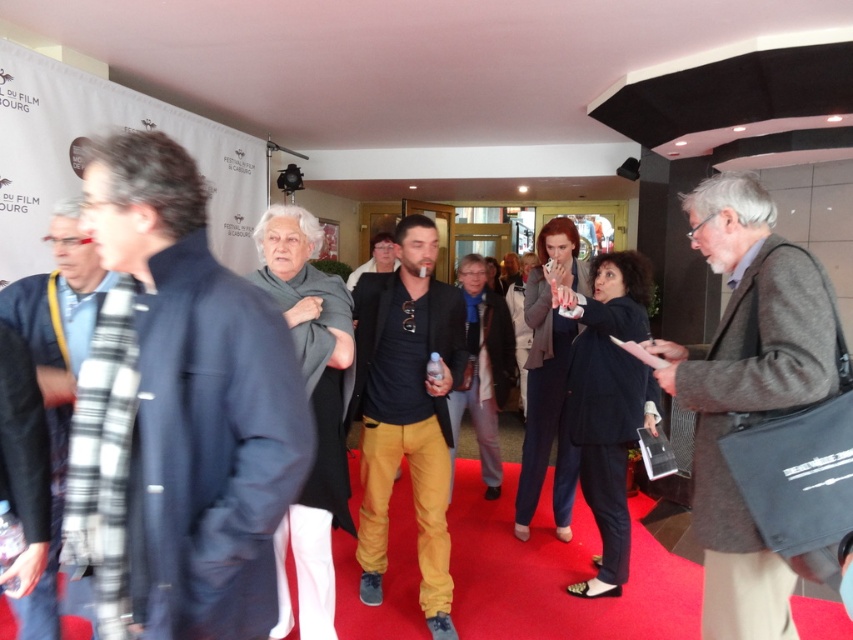
You are standing at the entrance of the festival venue and want to find the dark blue woolen jacket at center. Based on its 2D coordinates, in which direction should you move relative to your current position?

The dark blue woolen jacket at center is located at coordinates point (196, 401), so you should move towards the center of the venue to find it.

You are attending the film festival and want to find the dark blue woolen jacket at center. Where should you look relative to the plaid scarf at left?

The dark blue woolen jacket at center is located above the plaid scarf at left, so you should look upwards from the plaid scarf at left to find it.

You are a photographer at the film festival and need to capture a clear photo of the dark blue woolen jacket at center. The camera you are using has a minimum focusing distance of 1.2 meters. Can you take the photo without moving closer?

The dark blue woolen jacket at center and the viewer are 1.07 meters apart, which is less than the camera minimum focusing distance of 1.2 meters. Therefore, you cannot take the photo without moving closer.